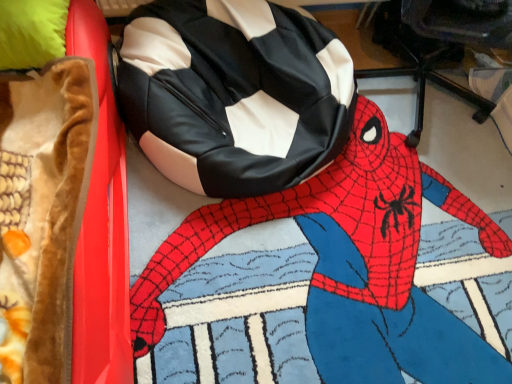
The image size is (512, 384). In order to click on vacant space to the right of black leather bean bag chair at center in this screenshot , I will do `click(434, 228)`.